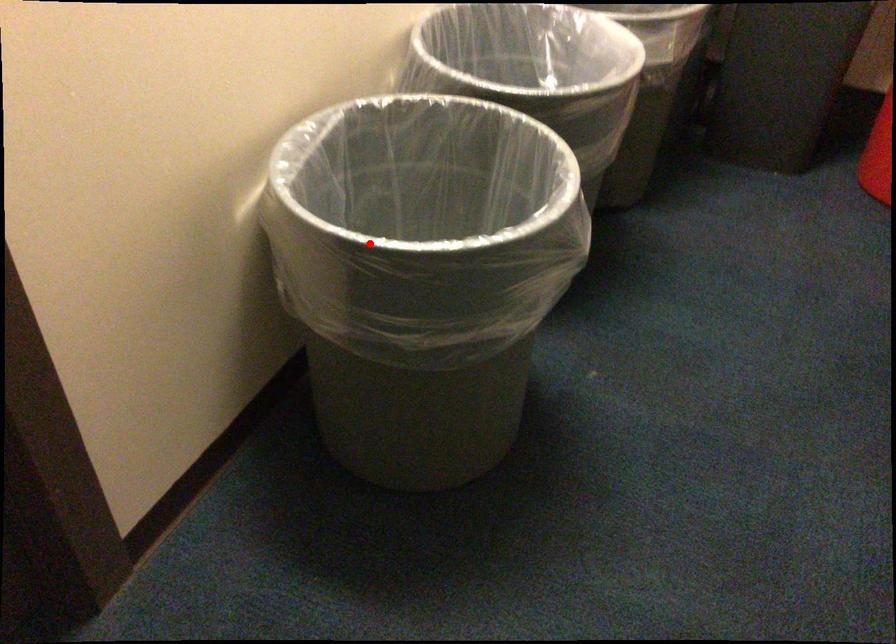
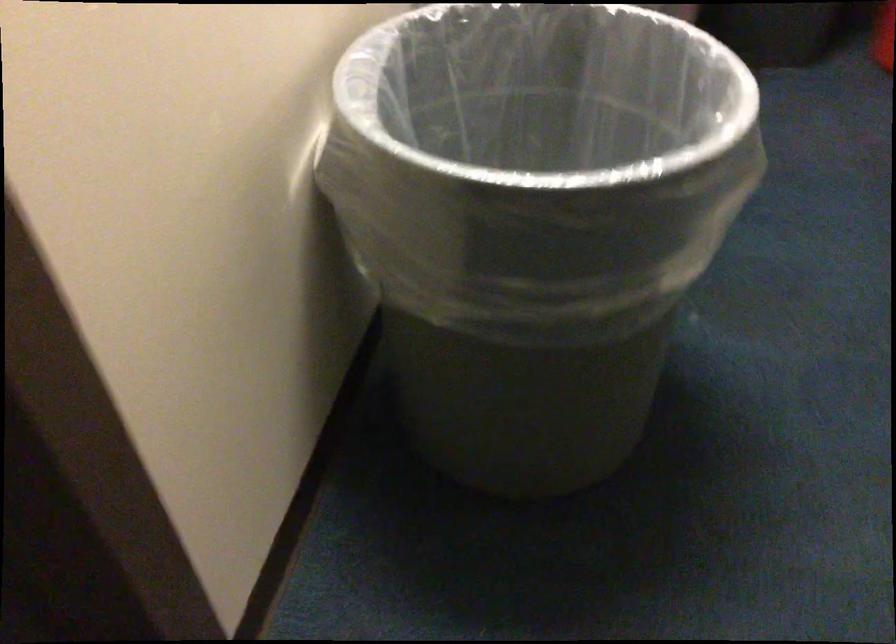
Where in the second image is the point corresponding to the highlighted location from the first image?

(538, 185)